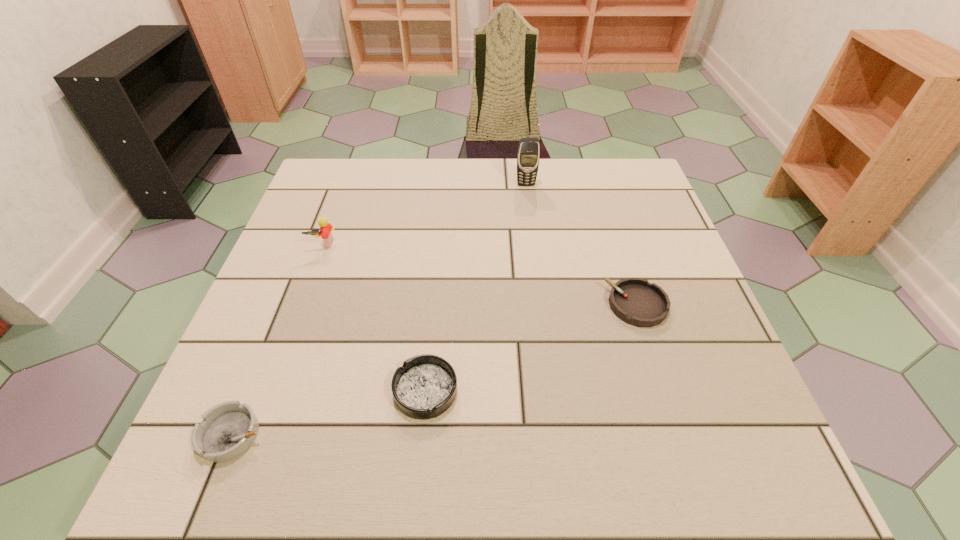
I want to click on vacant space that's between the rightmost object and the second farthest object, so click(480, 275).

Locate an element on the screen. This screenshot has width=960, height=540. empty location between the third object from left to right and the fourth object from left to right is located at coordinates (476, 287).

Locate an element on the screen. empty location between the second farthest object and the rightmost object is located at coordinates (x=480, y=275).

The height and width of the screenshot is (540, 960). In order to click on empty location between the farthest object and the third object from right to left in this screenshot , I will do (x=476, y=287).

Locate an element on the screen. The width and height of the screenshot is (960, 540). vacant point located between the second object from right to left and the leftmost ashtray is located at coordinates (379, 309).

Identify the location of object that is the second closest to the second object from right to left. (325, 228).

Identify which object is located as the third nearest to the cellular telephone. Please provide its 2D coordinates. Your answer should be formatted as a tuple, i.e. [(x, y)], where the tuple contains the x and y coordinates of a point satisfying the conditions above.

[(425, 387)]

Select which ashtray appears as the second closest to the farthest ashtray. Please provide its 2D coordinates. Your answer should be formatted as a tuple, i.e. [(x, y)], where the tuple contains the x and y coordinates of a point satisfying the conditions above.

[(228, 429)]

Point out which ashtray is positioned as the second nearest to the second object from right to left. Please provide its 2D coordinates. Your answer should be formatted as a tuple, i.e. [(x, y)], where the tuple contains the x and y coordinates of a point satisfying the conditions above.

[(425, 387)]

This screenshot has height=540, width=960. I want to click on free space that satisfies the following two spatial constraints: 1. in front of the fourth shortest object with the accessory visible; 2. on the left side of the second ashtray from left to right, so click(269, 391).